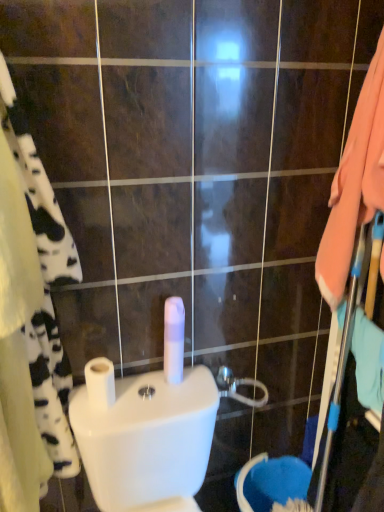
Question: Considering the positions of point (77, 270) and point (107, 398), is point (77, 270) closer or farther from the camera than point (107, 398)?

Choices:
 (A) closer
 (B) farther

Answer: (A)

Question: From the image's perspective, is white cotton bath towel at left above or below white matte toilet paper at center, marked as the 1th toilet paper in a left-to-right arrangement?

Choices:
 (A) below
 (B) above

Answer: (B)

Question: Which of these objects is positioned farthest from the metallic silver showerhead at center?

Choices:
 (A) white cotton bath towel at left
 (B) white matte toilet paper at center, acting as the first toilet paper starting from the right
 (C) white matte toilet paper at center, the 2th toilet paper viewed from the right
 (D) white glossy toilet bowl at center

Answer: (A)

Question: Which object is the farthest from the white glossy toilet bowl at center?

Choices:
 (A) metallic silver showerhead at center
 (B) white cotton bath towel at left
 (C) white matte toilet paper at center, marked as the 1th toilet paper in a left-to-right arrangement
 (D) white matte toilet paper at center, acting as the first toilet paper starting from the right

Answer: (A)